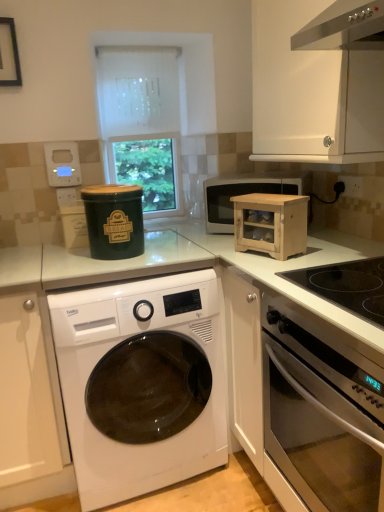
Question: Is white plastic electrical outlet at left, positioned as the first electric outlet in left-to-right order, bigger than black plastic electric outlet at upper right, which is counted as the first electric outlet, starting from the front?

Choices:
 (A) no
 (B) yes

Answer: (A)

Question: From a real-world perspective, is white plastic electrical outlet at left, the second electric outlet in the front-to-back sequence, over black plastic electric outlet at upper right, placed as the 2th electric outlet when sorted from left to right?

Choices:
 (A) no
 (B) yes

Answer: (B)

Question: Does white plastic electrical outlet at left, which is counted as the 2th electric outlet, starting from the right, have a smaller size compared to black plastic electric outlet at upper right, arranged as the second electric outlet when viewed from the back?

Choices:
 (A) yes
 (B) no

Answer: (A)

Question: From the image's perspective, would you say white plastic electrical outlet at left, the second electric outlet in the front-to-back sequence, is positioned over black plastic electric outlet at upper right, arranged as the second electric outlet when viewed from the back?

Choices:
 (A) yes
 (B) no

Answer: (B)

Question: Would you say white plastic electrical outlet at left, which is counted as the 2th electric outlet, starting from the right, is outside black plastic electric outlet at upper right, which is counted as the first electric outlet, starting from the front?

Choices:
 (A) no
 (B) yes

Answer: (B)

Question: Based on their sizes in the image, would you say white plastic electrical outlet at left, which appears as the first electric outlet when viewed from the back, is bigger or smaller than white matte cabinet at upper right, the 1th cabinetry in the top-to-bottom sequence?

Choices:
 (A) small
 (B) big

Answer: (A)

Question: Is point (66, 196) positioned closer to the camera than point (374, 106)?

Choices:
 (A) closer
 (B) farther

Answer: (B)

Question: Is white plastic electrical outlet at left, positioned as the first electric outlet in left-to-right order, inside the boundaries of white matte cabinet at upper right, the 1th cabinetry in the top-to-bottom sequence, or outside?

Choices:
 (A) outside
 (B) inside

Answer: (A)

Question: Is white plastic electrical outlet at left, which is counted as the 2th electric outlet, starting from the right, in front of or behind white matte cabinet at upper right, the first cabinetry from the right, in the image?

Choices:
 (A) front
 (B) behind

Answer: (B)

Question: In terms of height, does matte black microwave at center look taller or shorter compared to white matte cabinet at lower left, which is the 1th cabinetry from left to right?

Choices:
 (A) tall
 (B) short

Answer: (B)

Question: Considering their positions, is matte black microwave at center located in front of or behind white matte cabinet at lower left, which is the 1th cabinetry from left to right?

Choices:
 (A) front
 (B) behind

Answer: (B)

Question: Is point (301, 187) positioned closer to the camera than point (8, 325)?

Choices:
 (A) closer
 (B) farther

Answer: (B)

Question: Is matte black microwave at center situated inside white matte cabinet at lower left, the 2th cabinetry when ordered from right to left, or outside?

Choices:
 (A) inside
 (B) outside

Answer: (B)

Question: Based on their sizes in the image, would you say natural wood cabinet at right is bigger or smaller than green matte canister at center, arranged as the 1th appliance when viewed from the right?

Choices:
 (A) big
 (B) small

Answer: (B)

Question: Is natural wood cabinet at right wider or thinner than green matte canister at center, arranged as the 1th appliance when viewed from the right?

Choices:
 (A) thin
 (B) wide

Answer: (A)